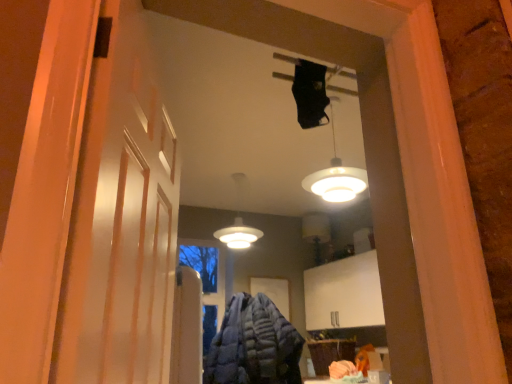
Question: Is blue quilted jacket at center surrounding white matte barn door at left?

Choices:
 (A) no
 (B) yes

Answer: (A)

Question: Is blue quilted jacket at center facing towards white matte barn door at left?

Choices:
 (A) yes
 (B) no

Answer: (B)

Question: Can you confirm if blue quilted jacket at center is positioned to the left of white matte barn door at left?

Choices:
 (A) no
 (B) yes

Answer: (A)

Question: Is blue quilted jacket at center facing away from white matte barn door at left?

Choices:
 (A) no
 (B) yes

Answer: (A)

Question: From the image's perspective, would you say blue quilted jacket at center is positioned over white matte barn door at left?

Choices:
 (A) yes
 (B) no

Answer: (B)

Question: Based on their sizes in the image, would you say white glossy lampshade at upper center, which appears as the second lamp when viewed from the left, is bigger or smaller than white matte lamp at center, marked as the 2th lamp in a right-to-left arrangement?

Choices:
 (A) small
 (B) big

Answer: (A)

Question: Is white glossy lampshade at upper center, positioned as the second lamp in back-to-front order, spatially inside white matte lamp at center, marked as the first lamp in a back-to-front arrangement, or outside of it?

Choices:
 (A) outside
 (B) inside

Answer: (A)

Question: Is point pos(355,173) closer or farther from the camera than point pos(230,230)?

Choices:
 (A) farther
 (B) closer

Answer: (B)

Question: In terms of height, does white glossy lampshade at upper center, which appears as the second lamp when viewed from the left, look taller or shorter compared to white matte lamp at center, acting as the second lamp starting from the front?

Choices:
 (A) tall
 (B) short

Answer: (B)

Question: Is blue quilted jacket at center wider or thinner than white matte barn door at left?

Choices:
 (A) thin
 (B) wide

Answer: (B)

Question: Looking at the image, does blue quilted jacket at center seem bigger or smaller compared to white matte barn door at left?

Choices:
 (A) small
 (B) big

Answer: (B)

Question: Is blue quilted jacket at center taller or shorter than white matte barn door at left?

Choices:
 (A) short
 (B) tall

Answer: (A)

Question: From a real-world perspective, is blue quilted jacket at center physically located above or below white matte barn door at left?

Choices:
 (A) above
 (B) below

Answer: (B)

Question: From a real-world perspective, is white matte barn door at left positioned above or below blue quilted jacket at center?

Choices:
 (A) below
 (B) above

Answer: (B)

Question: Considering the positions of point (109, 352) and point (262, 352), is point (109, 352) closer or farther from the camera than point (262, 352)?

Choices:
 (A) farther
 (B) closer

Answer: (B)